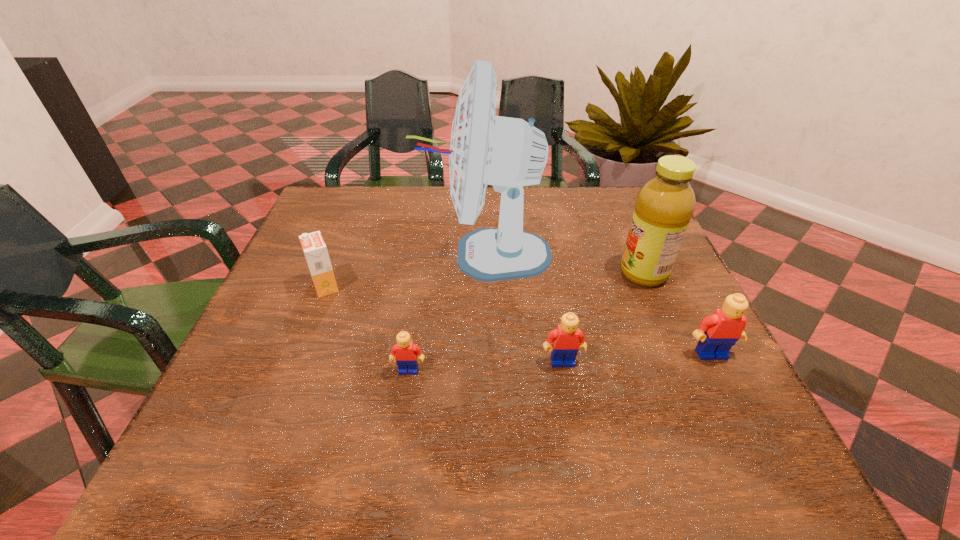
At what (x,y) coordinates should I click in order to perform the action: click on free space located 0.180m on the grille of the tallest object. Please return your answer as a coordinate pair (x, y). Image resolution: width=960 pixels, height=540 pixels. Looking at the image, I should click on (349, 254).

Locate an element on the screen. This screenshot has width=960, height=540. free space located 0.250m on the grille of the tallest object is located at coordinates (321, 254).

Locate an element on the screen. vacant space located on the front of the orange juice is located at coordinates (297, 360).

Where is `blank area located 0.220m on the front label of the second tallest object`? The height and width of the screenshot is (540, 960). blank area located 0.220m on the front label of the second tallest object is located at coordinates (524, 273).

This screenshot has height=540, width=960. I want to click on blank space located 0.230m on the front label of the second tallest object, so [520, 273].

Locate an element on the screen. The image size is (960, 540). vacant space positioned 0.350m on the front label of the second tallest object is located at coordinates 468,273.

Locate an element on the screen. This screenshot has height=540, width=960. object present at the far edge is located at coordinates (509, 153).

Locate an element on the screen. This screenshot has height=540, width=960. object positioned at the left edge is located at coordinates (314, 248).

This screenshot has height=540, width=960. In order to click on Lego that is positioned at the right edge in this screenshot , I will do `click(717, 333)`.

I want to click on fruit juice located in the right edge section of the desktop, so click(x=664, y=206).